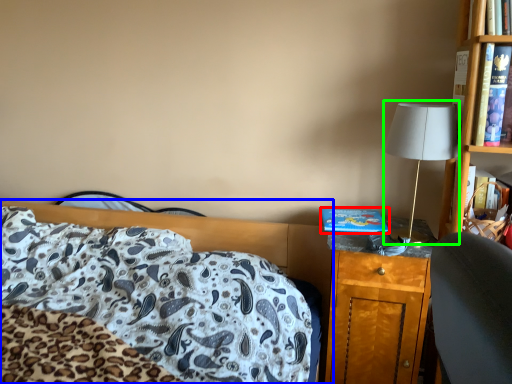
Question: Which is nearer to the hardback book (highlighted by a red box)? bed (highlighted by a blue box) or table lamp (highlighted by a green box).

Choices:
 (A) bed
 (B) table lamp

Answer: (B)